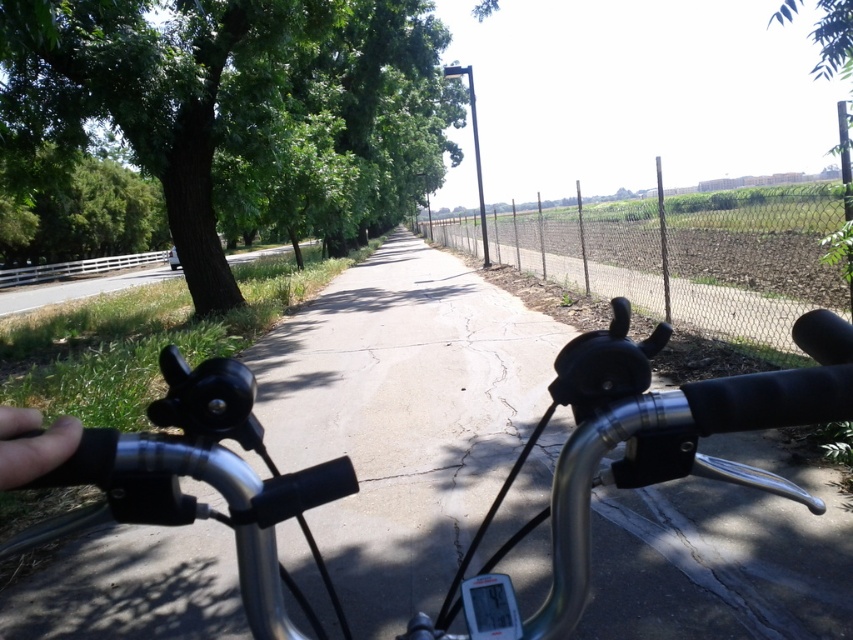
Question: Which object is farther from the camera taking this photo?

Choices:
 (A) green leafy tree at left
 (B) skinny finger at lower left
 (C) green leafy tree at upper right
 (D) polished silver bicycle handlebars at center

Answer: (A)

Question: Among these points, which one is farthest from the camera?

Choices:
 (A) [x=16, y=412]
 (B) [x=222, y=221]

Answer: (B)

Question: Is skinny finger at lower left below green leafy tree at upper right?

Choices:
 (A) no
 (B) yes

Answer: (B)

Question: Is polished silver bicycle handlebars at center to the left of skinny finger at lower left from the viewer's perspective?

Choices:
 (A) yes
 (B) no

Answer: (A)

Question: Which of these objects is positioned farthest from the skinny finger at lower left?

Choices:
 (A) green leafy tree at upper right
 (B) polished silver bicycle handlebars at center

Answer: (A)

Question: Can you confirm if polished silver bicycle handlebars at center is positioned below skinny finger at lower left?

Choices:
 (A) yes
 (B) no

Answer: (A)